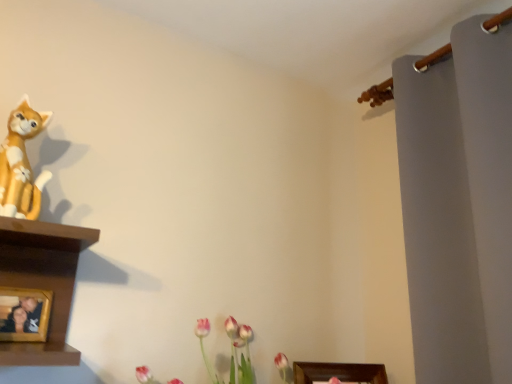
What do you see at coordinates (21, 164) in the screenshot? The height and width of the screenshot is (384, 512). I see `matte orange cat at left` at bounding box center [21, 164].

You are a GUI agent. You are given a task and a screenshot of the screen. Output one action in this format:
    pyautogui.click(x=<x>, y=<y>)
    Task: Click on the matte orange cat at left
    
    Given the screenshot: What is the action you would take?
    tap(21, 164)

Locate an element on the screen. The height and width of the screenshot is (384, 512). wooden photo frame at lower left is located at coordinates (24, 314).

What is the approximate width of wooden photo frame at lower left?

It is 2.28 inches.

This screenshot has width=512, height=384. What do you see at coordinates (24, 314) in the screenshot?
I see `wooden photo frame at lower left` at bounding box center [24, 314].

This screenshot has height=384, width=512. I want to click on matte orange cat at left, so click(x=21, y=164).

Is wooden photo frame at lower left to the right of matte orange cat at left from the viewer's perspective?

No, wooden photo frame at lower left is not to the right of matte orange cat at left.

Which is in front, wooden photo frame at lower left or matte orange cat at left?

matte orange cat at left is in front.

Considering the positions of point (28, 325) and point (20, 215), is point (28, 325) closer or farther from the camera than point (20, 215)?

Point (28, 325) appears to be farther away from the viewer than point (20, 215).

From the image's perspective, which is below, wooden photo frame at lower left or matte orange cat at left?

wooden photo frame at lower left, from the image's perspective.

From a real-world perspective, between wooden photo frame at lower left and matte orange cat at left, who is vertically higher?

matte orange cat at left, from a real-world perspective.

Can you confirm if wooden photo frame at lower left is wider than matte orange cat at left?

No.

Between wooden photo frame at lower left and matte orange cat at left, which one has more height?

matte orange cat at left.

Can you confirm if wooden photo frame at lower left is bigger than matte orange cat at left?

No, wooden photo frame at lower left is not bigger than matte orange cat at left.

Would you say wooden photo frame at lower left is outside matte orange cat at left?

Yes, wooden photo frame at lower left is located beyond the bounds of matte orange cat at left.

Is wooden photo frame at lower left next to matte orange cat at left and touching it?

No, wooden photo frame at lower left is not touching matte orange cat at left.

Is wooden photo frame at lower left aimed at matte orange cat at left?

No, wooden photo frame at lower left is not aimed at matte orange cat at left.

You are a GUI agent. You are given a task and a screenshot of the screen. Output one action in this format:
    pyautogui.click(x=<x>, y=<y>)
    Task: Click on the picture frame that is on the left side of matte orange cat at left
    This screenshot has height=384, width=512.
    Given the screenshot: What is the action you would take?
    pyautogui.click(x=24, y=314)

Is matte orange cat at left to the left or to the right of wooden photo frame at lower left in the image?

Based on their positions, matte orange cat at left is located to the right of wooden photo frame at lower left.

Relative to wooden photo frame at lower left, is matte orange cat at left in front or behind?

matte orange cat at left is in front of wooden photo frame at lower left.

Is point (20, 132) positioned before point (35, 314)?

Yes, it is.

Based on the photo, from the image's perspective, is matte orange cat at left above or below wooden photo frame at lower left?

matte orange cat at left is situated higher than wooden photo frame at lower left in the image.

From a real-world perspective, which object stands above the other?

From a 3D spatial view, matte orange cat at left is above.

Which object is wider, matte orange cat at left or wooden photo frame at lower left?

With larger width is matte orange cat at left.

Who is taller, matte orange cat at left or wooden photo frame at lower left?

matte orange cat at left is taller.

Is matte orange cat at left bigger than wooden photo frame at lower left?

Correct, matte orange cat at left is larger in size than wooden photo frame at lower left.

Can wooden photo frame at lower left be found inside matte orange cat at left?

Actually, wooden photo frame at lower left is outside matte orange cat at left.

Is matte orange cat at left next to wooden photo frame at lower left and touching it?

matte orange cat at left and wooden photo frame at lower left are clearly separated.

Is matte orange cat at left oriented away from wooden photo frame at lower left?

matte orange cat at left does not have its back to wooden photo frame at lower left.

How different are the orientations of matte orange cat at left and wooden photo frame at lower left in degrees?

The angular difference between matte orange cat at left and wooden photo frame at lower left is 8.96 degrees.

How much distance is there between matte orange cat at left and wooden photo frame at lower left?

They are 12.47 inches apart.

Find the location of a particular element. The image size is (512, 384). picture frame directly beneath the matte orange cat at left (from a real-world perspective) is located at coordinates (x=24, y=314).

Image resolution: width=512 pixels, height=384 pixels. I want to click on toy above the wooden photo frame at lower left (from a real-world perspective), so click(21, 164).

In the image, there is a matte orange cat at left. Identify the location of picture frame below it (from a real-world perspective). (24, 314).